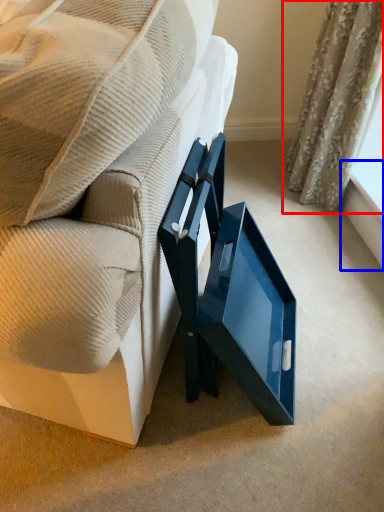
Question: Which object is closer to the camera taking this photo, curtain (highlighted by a red box) or window sill (highlighted by a blue box)?

Choices:
 (A) curtain
 (B) window sill

Answer: (A)